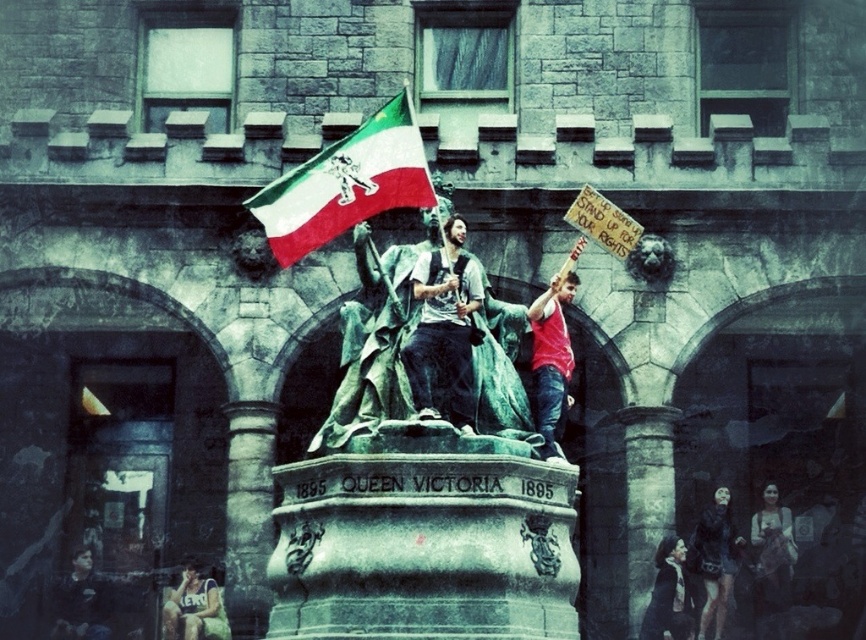
Question: Which object appears farthest from the camera in this image?

Choices:
 (A) red cotton tank top at upper center
 (B) matte gray statue at center
 (C) bronze statue at center

Answer: (A)

Question: Does red cotton tank top at upper center have a lesser width compared to dark gray hoodie at lower left?

Choices:
 (A) no
 (B) yes

Answer: (B)

Question: Is bronze statue at center below dark gray hoodie at lower left?

Choices:
 (A) yes
 (B) no

Answer: (B)

Question: Which object is the closest to the matte black backpack at lower right?

Choices:
 (A) red cotton tank top at upper center
 (B) white and green fabric flag at upper center
 (C) matte gray statue at center

Answer: (A)

Question: Which of the following is the closest to the observer?

Choices:
 (A) matte black backpack at lower right
 (B) red cotton tank top at upper center

Answer: (B)

Question: Can you confirm if white and green fabric flag at upper center is wider than matte blue tank top at lower left?

Choices:
 (A) yes
 (B) no

Answer: (A)